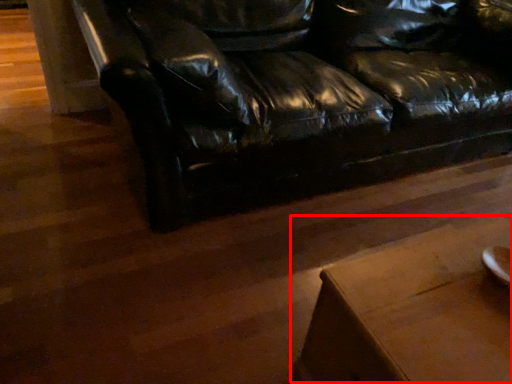
Question: From the image's perspective, what is the correct spatial positioning of table (annotated by the red box) in reference to studio couch?

Choices:
 (A) above
 (B) below

Answer: (B)